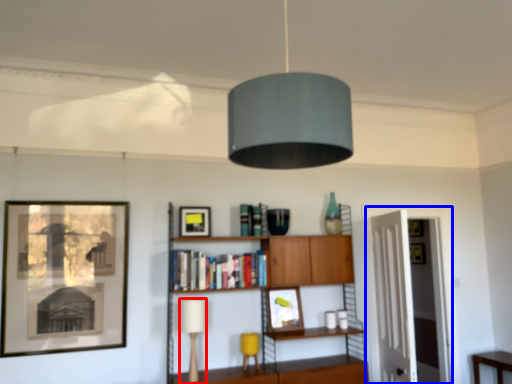
Question: Which object appears closest to the camera in this image, table lamp (highlighted by a red box) or glass door (highlighted by a blue box)?

Choices:
 (A) table lamp
 (B) glass door

Answer: (A)